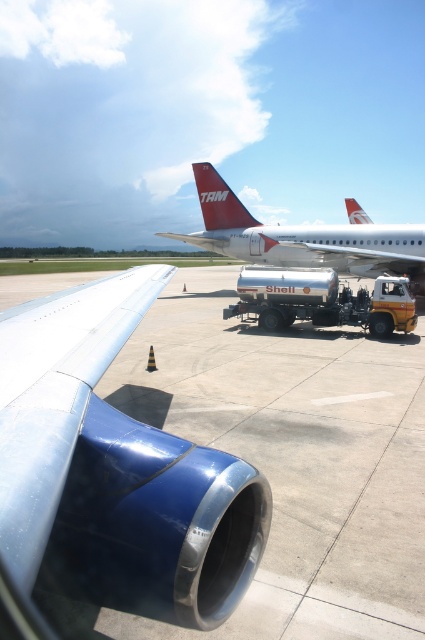
You are a maintenance worker at the airport. You need to walk from the blue metallic engine at center to the metallic silver airplane at center. How many steps would you need to take if each step covers about 2.2 feet?

The blue metallic engine at center is 44.15 feet away from the metallic silver airplane at center. Dividing the distance by the step length gives 44.15 divided by 2.2 equals approximately 20 steps. So you would need to take around 20 steps.

You are a ground crew member standing at the edge of the tarmac. You need to walk from the blue metallic engine at center to the metallic silver airplane at center. Which direction should you move?

The blue metallic engine at center is to the left of the metallic silver airplane at center, so you should move to the right to reach the metallic silver airplane at center from the blue metallic engine at center.